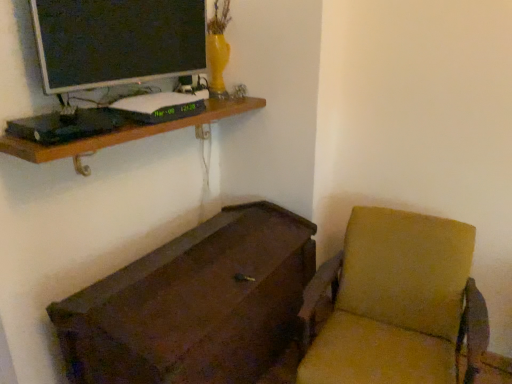
Question: Is brown wooden shelf at upper left located within matte black monitor at upper left?

Choices:
 (A) yes
 (B) no

Answer: (B)

Question: Is matte black monitor at upper left smaller than brown wooden shelf at upper left?

Choices:
 (A) yes
 (B) no

Answer: (A)

Question: Could you tell me if matte black monitor at upper left is facing brown wooden shelf at upper left?

Choices:
 (A) yes
 (B) no

Answer: (B)

Question: From the image's perspective, is matte black monitor at upper left under brown wooden shelf at upper left?

Choices:
 (A) yes
 (B) no

Answer: (B)

Question: Can you confirm if matte black monitor at upper left is shorter than brown wooden shelf at upper left?

Choices:
 (A) no
 (B) yes

Answer: (A)

Question: Is matte black monitor at upper left to the right of brown wooden shelf at upper left from the viewer's perspective?

Choices:
 (A) no
 (B) yes

Answer: (A)

Question: Considering the relative sizes of brown wooden shelf at upper left and matte black monitor at upper left in the image provided, is brown wooden shelf at upper left wider than matte black monitor at upper left?

Choices:
 (A) no
 (B) yes

Answer: (B)

Question: Does brown wooden shelf at upper left have a larger size compared to matte black monitor at upper left?

Choices:
 (A) yes
 (B) no

Answer: (A)

Question: Would you say brown wooden shelf at upper left is outside matte black monitor at upper left?

Choices:
 (A) yes
 (B) no

Answer: (A)

Question: Is there a large distance between brown wooden shelf at upper left and matte black monitor at upper left?

Choices:
 (A) no
 (B) yes

Answer: (A)

Question: Does brown wooden shelf at upper left appear on the right side of matte black monitor at upper left?

Choices:
 (A) no
 (B) yes

Answer: (B)

Question: Is the depth of brown wooden shelf at upper left greater than that of matte black monitor at upper left?

Choices:
 (A) no
 (B) yes

Answer: (A)

Question: Is brown wooden chest at lower left far away from brown wooden shelf at upper left?

Choices:
 (A) yes
 (B) no

Answer: (B)